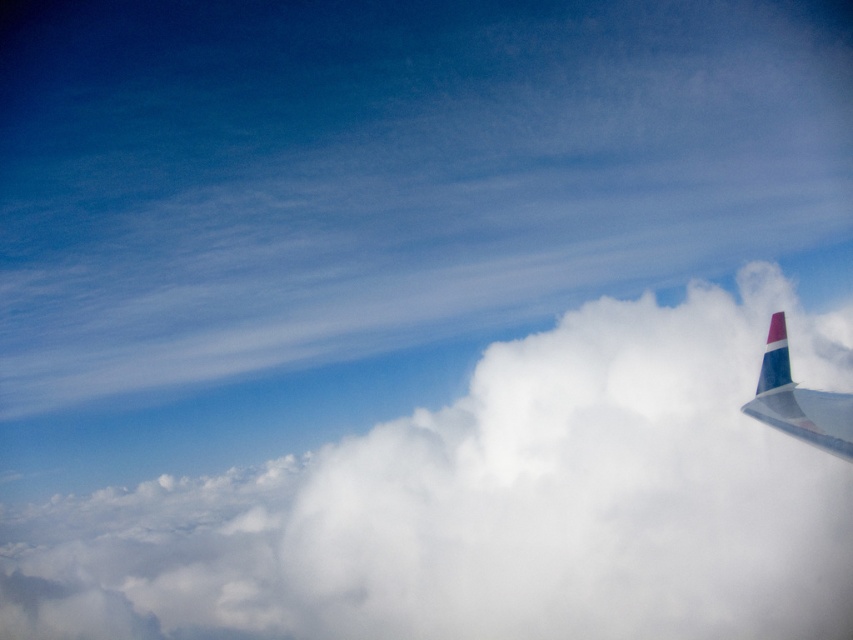
Question: Which point is closer to the camera taking this photo?

Choices:
 (A) (769, 420)
 (B) (705, 515)

Answer: (A)

Question: Does white fluffy cloud at upper right come behind polished aluminum winglet at upper right?

Choices:
 (A) yes
 (B) no

Answer: (B)

Question: Is white fluffy cloud at upper right further to camera compared to polished aluminum winglet at upper right?

Choices:
 (A) no
 (B) yes

Answer: (A)

Question: Does white fluffy cloud at upper right appear on the left side of polished aluminum winglet at upper right?

Choices:
 (A) yes
 (B) no

Answer: (A)

Question: Among these objects, which one is nearest to the camera?

Choices:
 (A) polished aluminum winglet at upper right
 (B) white fluffy cloud at upper right

Answer: (B)

Question: Among these points, which one is nearest to the camera?

Choices:
 (A) (27, 545)
 (B) (814, 390)

Answer: (B)